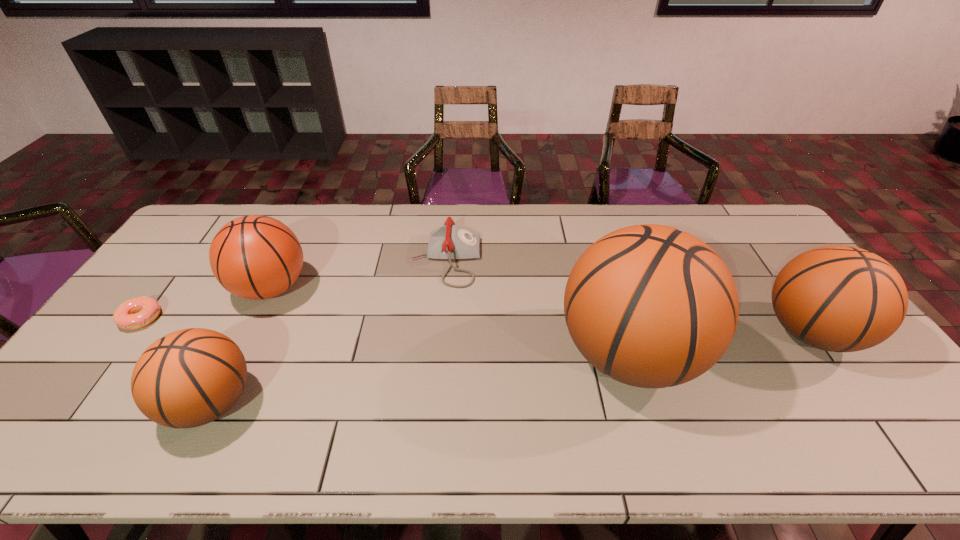
Locate an element on the screen. This screenshot has width=960, height=540. free space located on the right of the leftmost object is located at coordinates (209, 318).

Where is `object that is at the far edge`? The image size is (960, 540). object that is at the far edge is located at coordinates (449, 242).

Locate an element on the screen. Image resolution: width=960 pixels, height=540 pixels. object that is at the left edge is located at coordinates (135, 313).

At what (x,y) coordinates should I click in order to perform the action: click on object positioned at the right edge. Please return your answer as a coordinate pair (x, y). This screenshot has height=540, width=960. Looking at the image, I should click on (836, 298).

At what (x,y) coordinates should I click in order to perform the action: click on vacant space at the far edge of the desktop. Please return your answer as a coordinate pair (x, y). The height and width of the screenshot is (540, 960). Looking at the image, I should click on (493, 237).

Locate an element on the screen. vacant space at the near edge is located at coordinates (457, 383).

Where is `vacant space at the right edge of the desktop`? vacant space at the right edge of the desktop is located at coordinates (771, 275).

In the image, there is a desktop. Where is `vacant area at the far left corner`? The width and height of the screenshot is (960, 540). vacant area at the far left corner is located at coordinates (207, 212).

This screenshot has height=540, width=960. I want to click on free spot between the doughnut and the fifth object from left to right, so click(385, 336).

At what (x,y) coordinates should I click in order to perform the action: click on vacant space that is in between the leftmost object and the tallest object. Please return your answer as a coordinate pair (x, y). The width and height of the screenshot is (960, 540). Looking at the image, I should click on [385, 336].